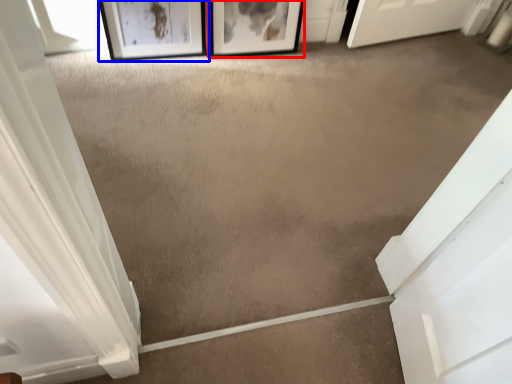
Question: Which point is further to the camera, picture frame (highlighted by a red box) or picture frame (highlighted by a blue box)?

Choices:
 (A) picture frame
 (B) picture frame

Answer: (A)